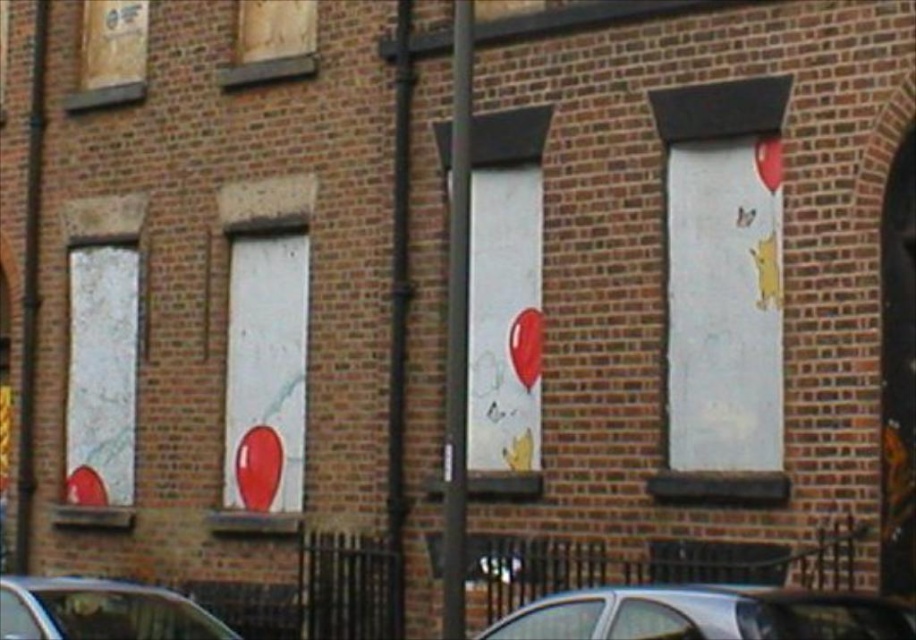
Is silver metallic car at lower center behind brushed metal pole at left?

That is False.

Is silver metallic car at lower center closer to camera compared to brushed metal pole at left?

Yes, silver metallic car at lower center is in front of brushed metal pole at left.

Identify the location of silver metallic car at lower center. The height and width of the screenshot is (640, 916). (705, 614).

Locate an element on the screen. The image size is (916, 640). silver metallic car at lower center is located at coordinates (705, 614).

Between metallic pole at center and metallic silver car at lower left, which one has more height?

metallic pole at center is taller.

Can you confirm if metallic pole at center is smaller than metallic silver car at lower left?

Indeed, metallic pole at center has a smaller size compared to metallic silver car at lower left.

Measure the distance between point (467, 230) and camera.

Point (467, 230) is 9.93 meters away from camera.

Identify the location of metallic pole at center. coord(458,330).

Is metallic pole at center shorter than brushed metal pole at left?

Indeed, metallic pole at center has a lesser height compared to brushed metal pole at left.

Is metallic pole at center below brushed metal pole at left?

Yes.

Is point (455, 28) behind point (31, 61)?

No, it is in front of (31, 61).

Find the location of a particular element. The height and width of the screenshot is (640, 916). metallic pole at center is located at coordinates (458, 330).